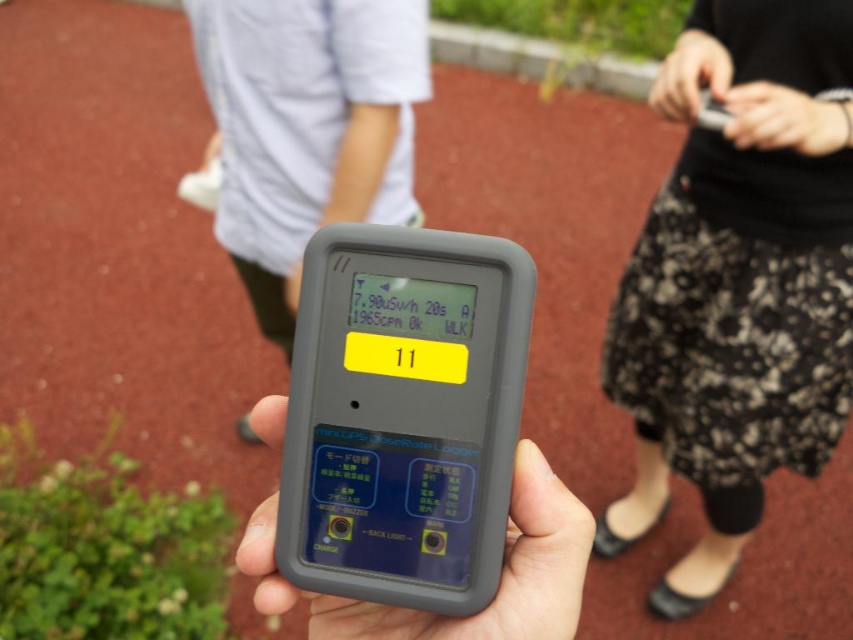
Question: Is black lace skirt at lower right wider than black rubberized device at center?

Choices:
 (A) yes
 (B) no

Answer: (A)

Question: Which point is closer to the camera?

Choices:
 (A) (753, 332)
 (B) (326, 628)

Answer: (B)

Question: Among these objects, which one is farthest from the camera?

Choices:
 (A) black rubberized device at center
 (B) black lace skirt at lower right

Answer: (B)

Question: Is black lace skirt at lower right to the left of black rubberized device at center from the viewer's perspective?

Choices:
 (A) yes
 (B) no

Answer: (B)

Question: Is black lace skirt at lower right to the right of black rubberized device at center from the viewer's perspective?

Choices:
 (A) no
 (B) yes

Answer: (B)